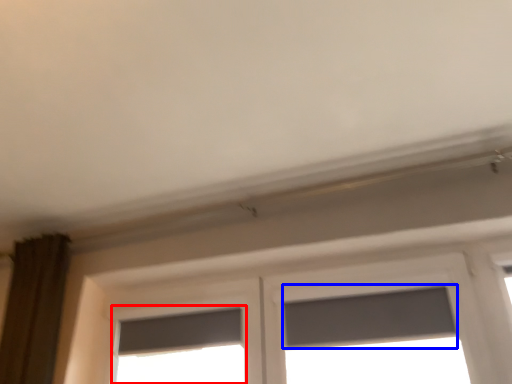
Question: Which of the following is the closest to the observer, window (highlighted by a red box) or window screen (highlighted by a blue box)?

Choices:
 (A) window
 (B) window screen

Answer: (B)